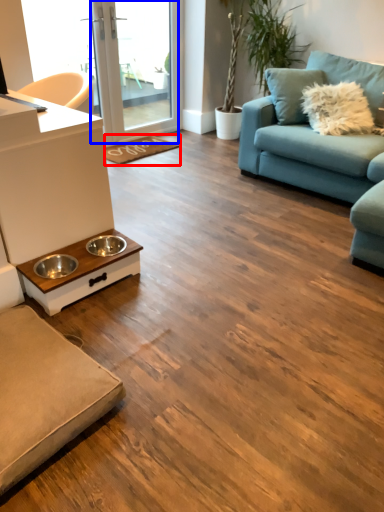
Question: Which object is further to the camera taking this photo, doormat (highlighted by a red box) or screen door (highlighted by a blue box)?

Choices:
 (A) doormat
 (B) screen door

Answer: (A)